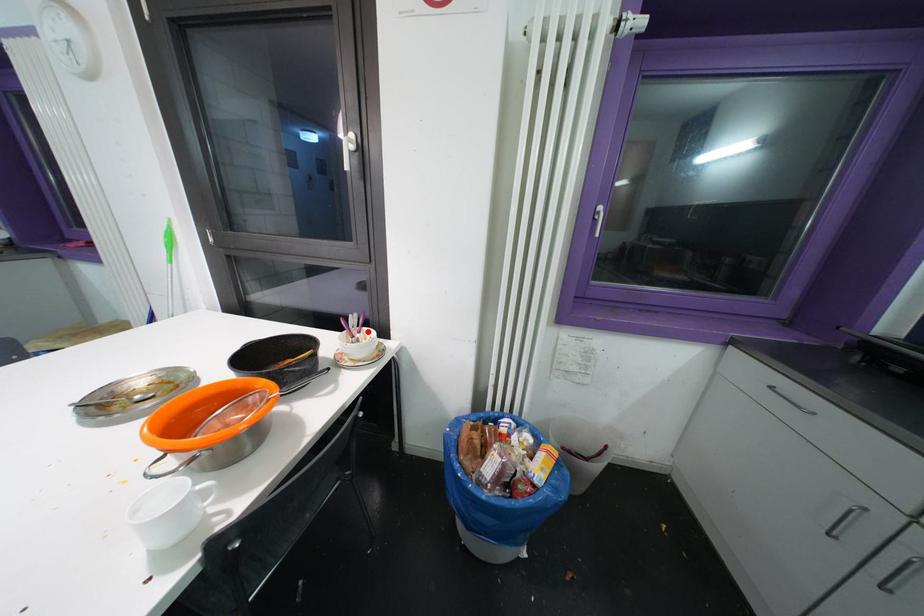
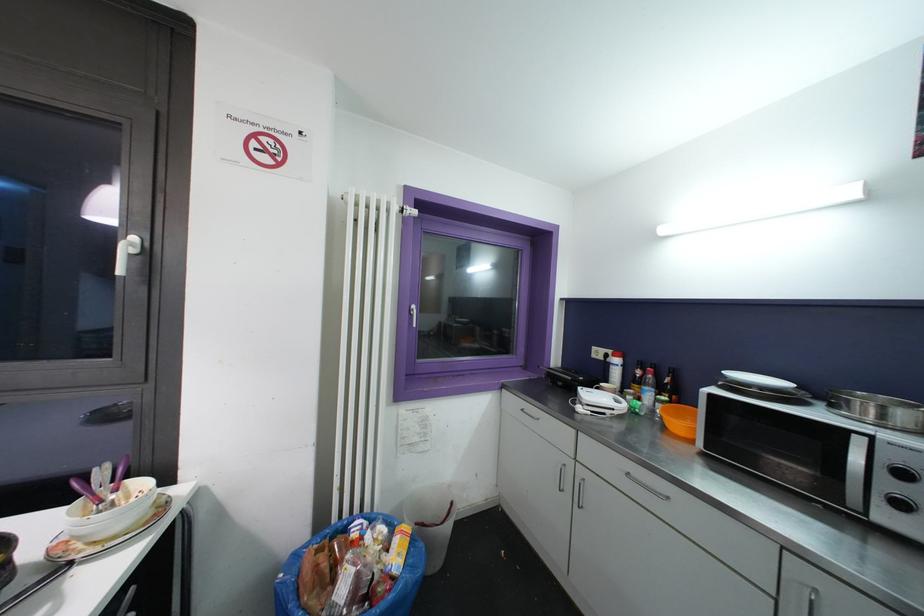
In the second image, find the point that corresponds to the highlighted location in the first image.

(131, 484)